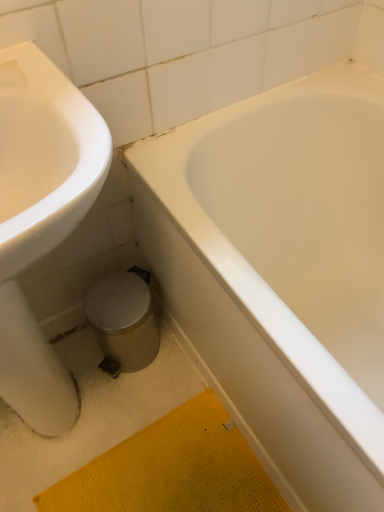
Describe the element at coordinates (172, 470) in the screenshot. I see `yellow textured bath mat at lower center` at that location.

What do you see at coordinates (282, 271) in the screenshot? I see `white glossy bathtub at center` at bounding box center [282, 271].

Locate an element on the screen. yellow textured bath mat at lower center is located at coordinates (172, 470).

Which of these two, white glossy sink at left or white glossy bathtub at center, stands taller?

white glossy sink at left.

Considering the sizes of white glossy sink at left and white glossy bathtub at center in the image, is white glossy sink at left wider or thinner than white glossy bathtub at center?

Clearly, white glossy sink at left has less width compared to white glossy bathtub at center.

Is white glossy sink at left closer to camera compared to white glossy bathtub at center?

That is True.

Is white glossy sink at left at the left side of white glossy bathtub at center?

Yes.

In the image, is white glossy sink at left on the left side or the right side of yellow textured bath mat at lower center?

From the image, it's evident that white glossy sink at left is to the left of yellow textured bath mat at lower center.

This screenshot has width=384, height=512. I want to click on sink on the left of yellow textured bath mat at lower center, so click(41, 218).

Can you confirm if white glossy sink at left is shorter than yellow textured bath mat at lower center?

No.

Between white glossy bathtub at center and yellow textured bath mat at lower center, which one appears on the left side from the viewer's perspective?

From the viewer's perspective, yellow textured bath mat at lower center appears more on the left side.

Is point (376, 329) behind point (89, 511)?

Yes, point (376, 329) is behind point (89, 511).

Is white glossy bathtub at center oriented towards yellow textured bath mat at lower center?

Yes, white glossy bathtub at center is turned towards yellow textured bath mat at lower center.

Where is `bathtub above the yellow textured bath mat at lower center (from a real-world perspective)`? The width and height of the screenshot is (384, 512). bathtub above the yellow textured bath mat at lower center (from a real-world perspective) is located at coordinates (282, 271).

Is white glossy bathtub at center completely or partially outside of white glossy sink at left?

white glossy bathtub at center is positioned outside white glossy sink at left.

You are a GUI agent. You are given a task and a screenshot of the screen. Output one action in this format:
    pyautogui.click(x=<x>, y=<y>)
    Task: Click on the sink that is above the white glossy bathtub at center (from a real-world perspective)
    
    Given the screenshot: What is the action you would take?
    pyautogui.click(x=41, y=218)

Which object is positioned more to the left, white glossy bathtub at center or white glossy sink at left?

Positioned to the left is white glossy sink at left.

Is white glossy bathtub at center oriented away from white glossy sink at left?

No, white glossy bathtub at center is not facing away from white glossy sink at left.

Which is in front, yellow textured bath mat at lower center or white glossy sink at left?

white glossy sink at left is more forward.

Between yellow textured bath mat at lower center and white glossy sink at left, which one appears on the left side from the viewer's perspective?

white glossy sink at left.

Based on the photo, which of these two, yellow textured bath mat at lower center or white glossy sink at left, is bigger?

With larger size is white glossy sink at left.

Is yellow textured bath mat at lower center outside of white glossy sink at left?

Yes, yellow textured bath mat at lower center is outside of white glossy sink at left.

Is yellow textured bath mat at lower center far from white glossy bathtub at center?

yellow textured bath mat at lower center is near white glossy bathtub at center, not far away.

Would you say yellow textured bath mat at lower center is to the left or to the right of white glossy bathtub at center in the picture?

Based on their positions, yellow textured bath mat at lower center is located to the left of white glossy bathtub at center.

Can you tell me how much yellow textured bath mat at lower center and white glossy bathtub at center differ in facing direction?

The angle between the facing direction of yellow textured bath mat at lower center and the facing direction of white glossy bathtub at center is 0.153 degrees.

Would you say yellow textured bath mat at lower center is inside or outside white glossy bathtub at center?

yellow textured bath mat at lower center lies outside white glossy bathtub at center.

Image resolution: width=384 pixels, height=512 pixels. I want to click on bathtub above the white glossy sink at left (from the image's perspective), so click(x=282, y=271).

At what (x,y) coordinates should I click in order to perform the action: click on sink on the left side of yellow textured bath mat at lower center. Please return your answer as a coordinate pair (x, y). Image resolution: width=384 pixels, height=512 pixels. Looking at the image, I should click on (41, 218).

When comparing their distances from white glossy bathtub at center, does white glossy sink at left or yellow textured bath mat at lower center seem closer?

yellow textured bath mat at lower center.

Based on their spatial positions, is white glossy bathtub at center or white glossy sink at left further from yellow textured bath mat at lower center?

white glossy bathtub at center is positioned further to the anchor yellow textured bath mat at lower center.

From the image, which object appears to be nearer to white glossy sink at left, yellow textured bath mat at lower center or white glossy bathtub at center?

The object closer to white glossy sink at left is yellow textured bath mat at lower center.

Looking at the image, which one is located closer to white glossy bathtub at center, yellow textured bath mat at lower center or white glossy sink at left?

yellow textured bath mat at lower center lies closer to white glossy bathtub at center than the other object.

Which object lies further to the anchor point yellow textured bath mat at lower center, white glossy sink at left or white glossy bathtub at center?

Based on the image, white glossy bathtub at center appears to be further to yellow textured bath mat at lower center.

In the scene shown: Estimate the real-world distances between objects in this image. Which object is further from white glossy sink at left, white glossy bathtub at center or yellow textured bath mat at lower center?

Based on the image, white glossy bathtub at center appears to be further to white glossy sink at left.

At what (x,y) coordinates should I click in order to perform the action: click on bath mat situated between white glossy sink at left and white glossy bathtub at center from left to right. Please return your answer as a coordinate pair (x, y). Looking at the image, I should click on (172, 470).